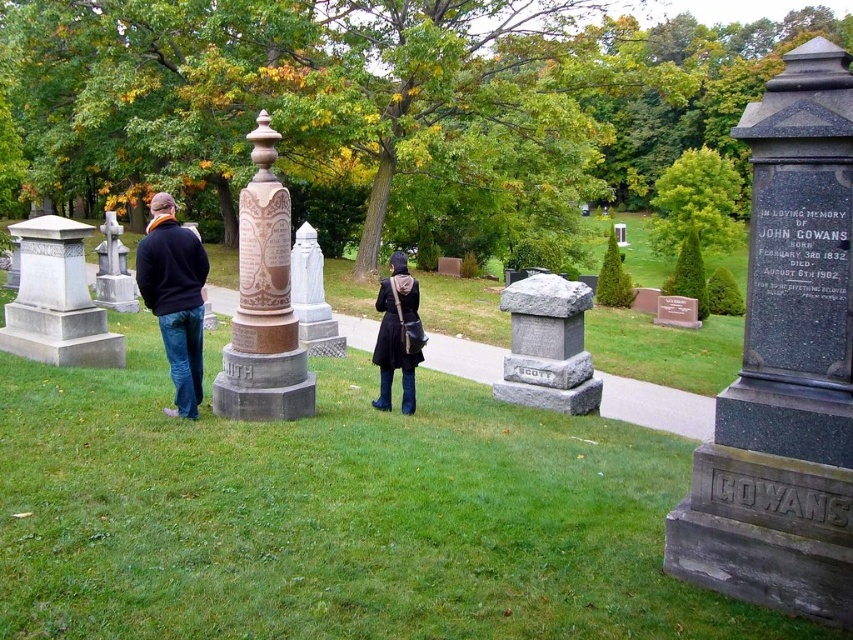
Question: Estimate the real-world distances between objects in this image. Which object is closer to the dark blue sweater at left?

Choices:
 (A) smooth gray stone cross at left
 (B) marble/carved stone monument at center
 (C) gray stone gravestone at center

Answer: (B)

Question: Which object is closer to the camera taking this photo?

Choices:
 (A) dark blue sweater at left
 (B) dark brown leather jacket at center
 (C) gray stone gravestone at center

Answer: (A)

Question: Does granite gravestone at right have a greater width compared to matte brown statue at center?

Choices:
 (A) yes
 (B) no

Answer: (B)

Question: Considering the real-world distances, which object is farthest from the dark brown leather jacket at center?

Choices:
 (A) marble/carved stone monument at center
 (B) matte brown statue at center
 (C) gray stone monument at left
 (D) gray stone gravestone at center

Answer: (C)

Question: Is marble/carved stone monument at center wider than gray stone monument at left?

Choices:
 (A) no
 (B) yes

Answer: (B)

Question: Is gray stone gravestone at center to the left of dark brown leather jacket at center from the viewer's perspective?

Choices:
 (A) no
 (B) yes

Answer: (A)